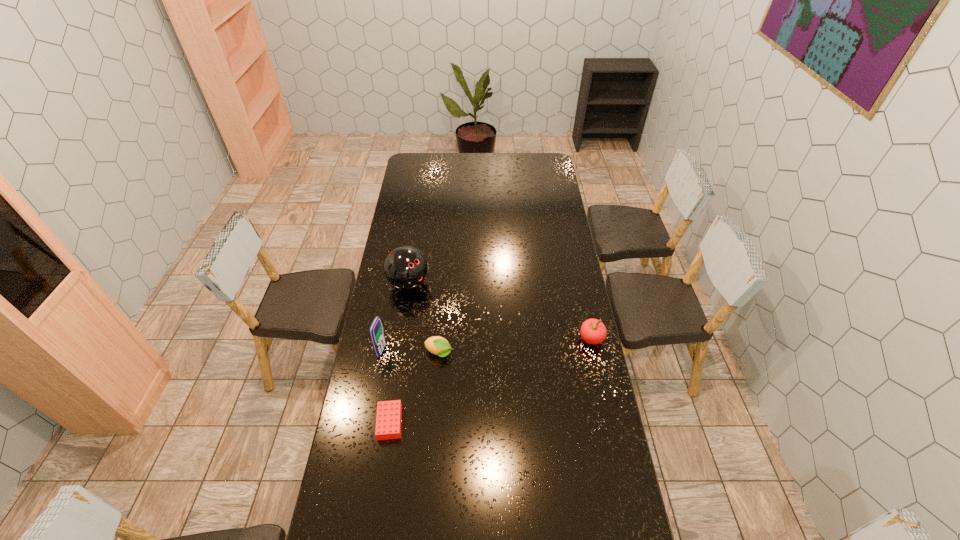
At what (x,y) coordinates should I click in order to perform the action: click on the nearest object. Please return your answer as a coordinate pair (x, y). The width and height of the screenshot is (960, 540). Looking at the image, I should click on (389, 413).

I want to click on the shortest object, so click(x=389, y=413).

Locate an element on the screen. The image size is (960, 540). apple is located at coordinates [x=593, y=331].

The width and height of the screenshot is (960, 540). In order to click on the third shortest object in this screenshot , I will do `click(593, 331)`.

Where is `cellular telephone`? This screenshot has width=960, height=540. cellular telephone is located at coordinates (376, 332).

This screenshot has width=960, height=540. I want to click on bowling ball, so click(406, 267).

Find the location of `the second shortest object`. the second shortest object is located at coordinates (437, 345).

Where is `lemon`? This screenshot has width=960, height=540. lemon is located at coordinates (437, 345).

Locate an element on the screen. The width and height of the screenshot is (960, 540). free space located 0.180m on the back of the Lego is located at coordinates (398, 362).

Find the location of a particular element. vacant area situated on the back of the rightmost object is located at coordinates (582, 298).